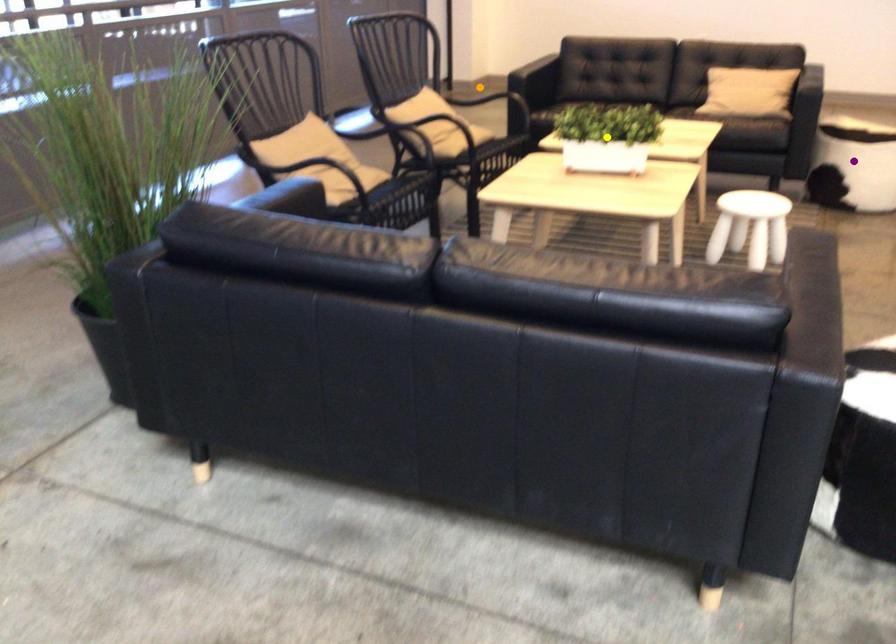
Order these from farthest to nearest:
A) orange point
B) purple point
C) yellow point

orange point
purple point
yellow point